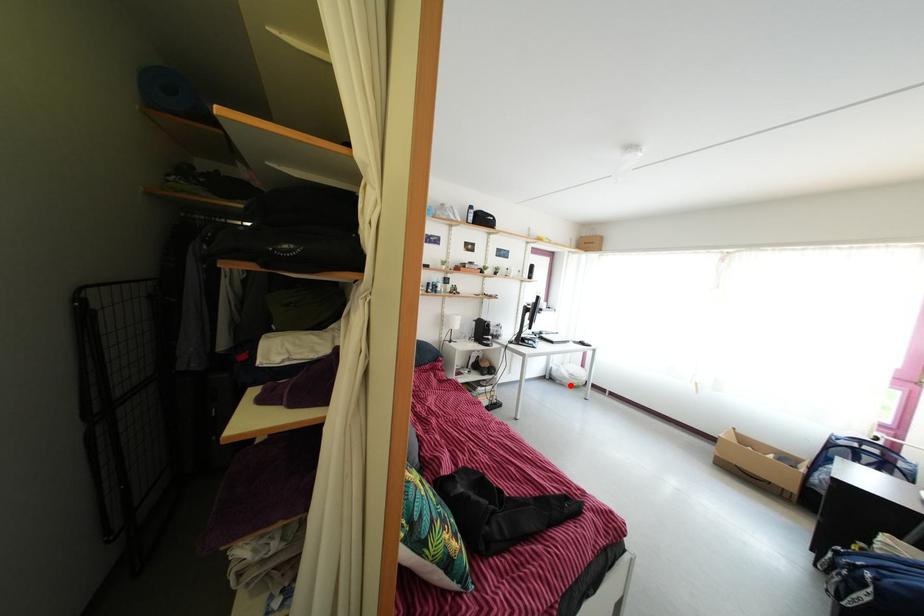
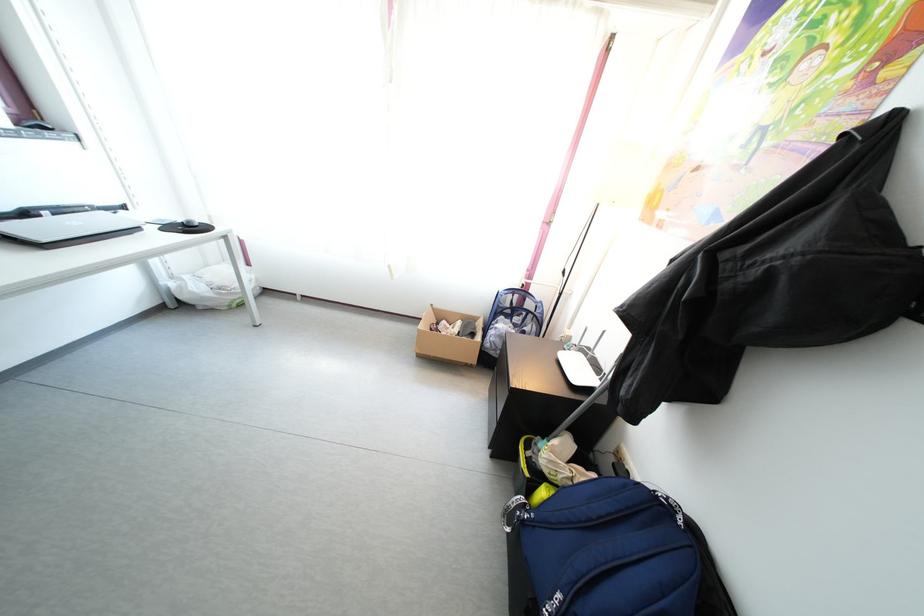
Where in the second image is the point corresponding to the highlighted location from the first image?

(210, 306)